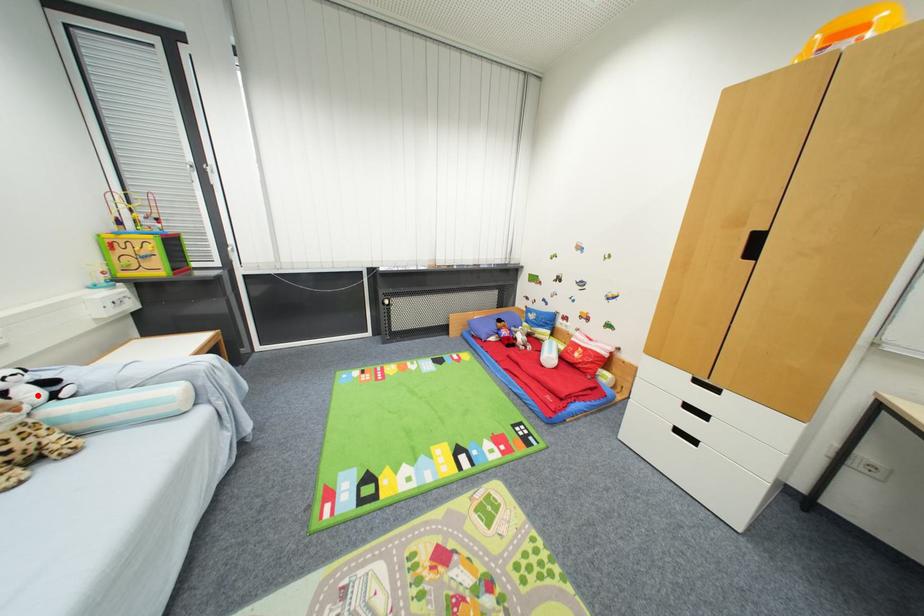
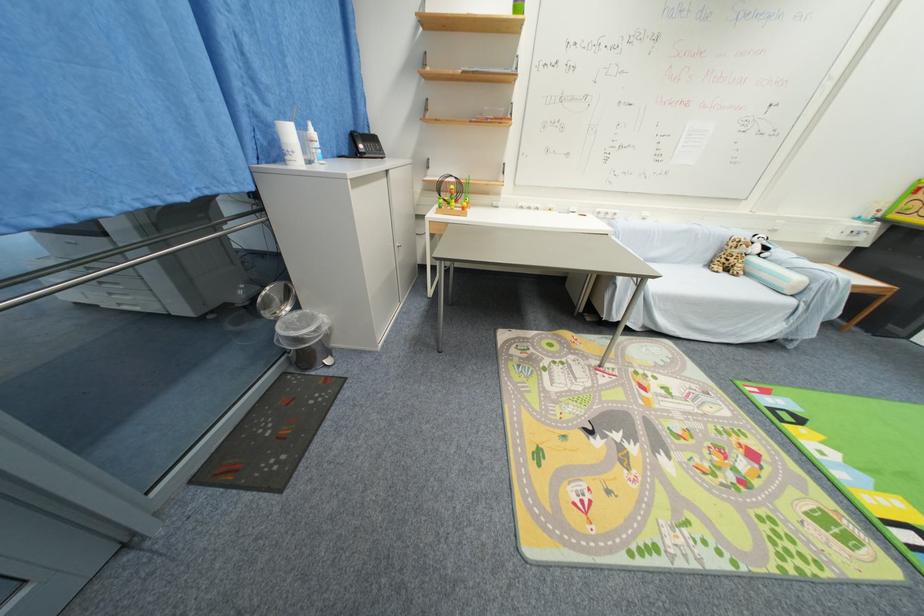
Where in the second image is the point corresponding to the highlighted location from the first image?

(761, 251)